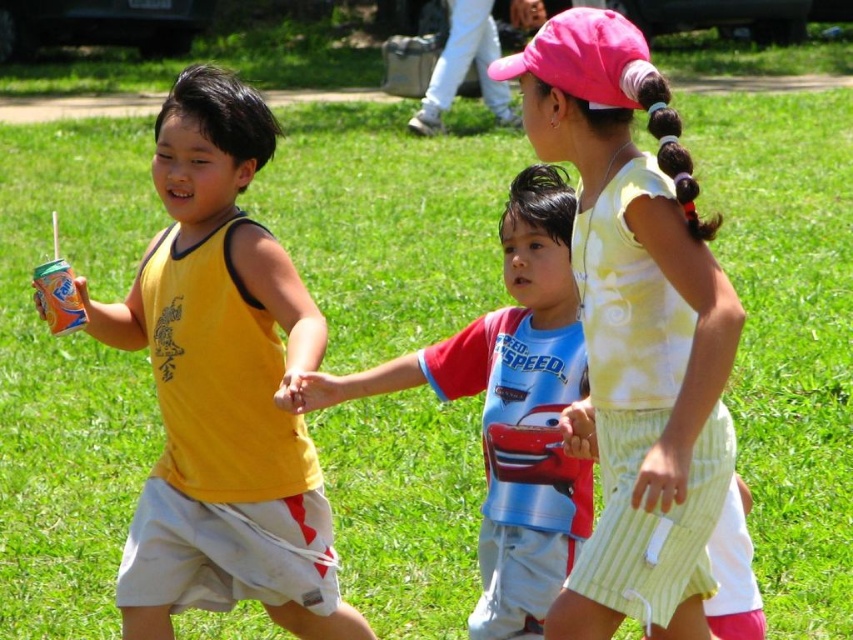
You are a photographer trying to capture a group photo of the children. You notice the yellow sleeveless shirt at left and the red and blue cotton shirt at center. Which child should you ask to move down so that both shirts are at the same level for the photo?

The yellow sleeveless shirt at left is above the red and blue cotton shirt at center, so you should ask the child wearing the yellow sleeveless shirt at left to move down so both shirts are at the same level.